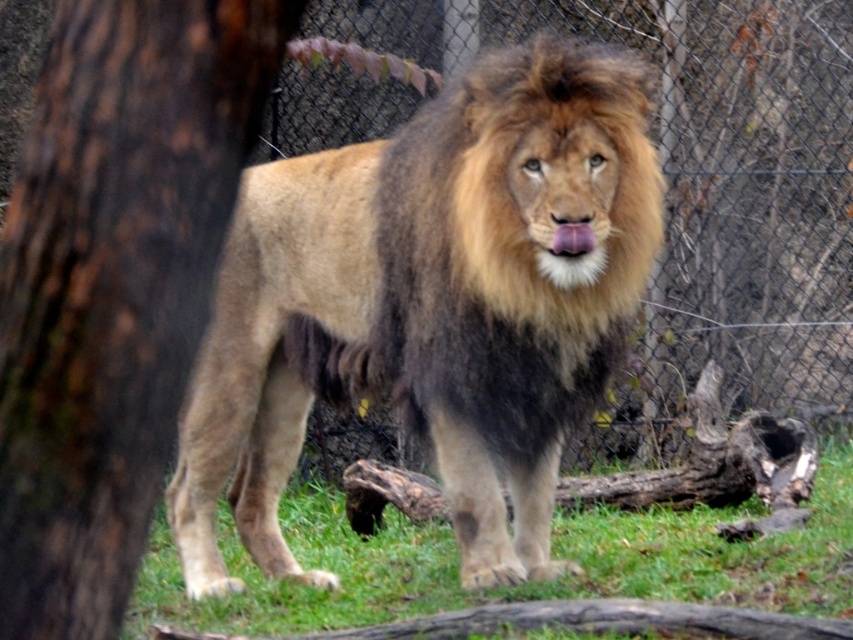
Question: Can you confirm if golden fur lion at center is positioned above wire mesh fence at center?

Choices:
 (A) yes
 (B) no

Answer: (B)

Question: Is golden fur lion at center above brown rough bark at left?

Choices:
 (A) yes
 (B) no

Answer: (B)

Question: Which object appears farthest from the camera in this image?

Choices:
 (A) brown rough bark at left
 (B) green grass at center
 (C) golden fur lion at center

Answer: (B)

Question: Among these points, which one is farthest from the camera?

Choices:
 (A) (170, 326)
 (B) (473, 524)

Answer: (B)

Question: Does golden fur lion at center have a smaller size compared to wire mesh fence at center?

Choices:
 (A) no
 (B) yes

Answer: (B)

Question: Which of the following is the farthest from the observer?

Choices:
 (A) green grass at center
 (B) golden fur lion at center

Answer: (A)